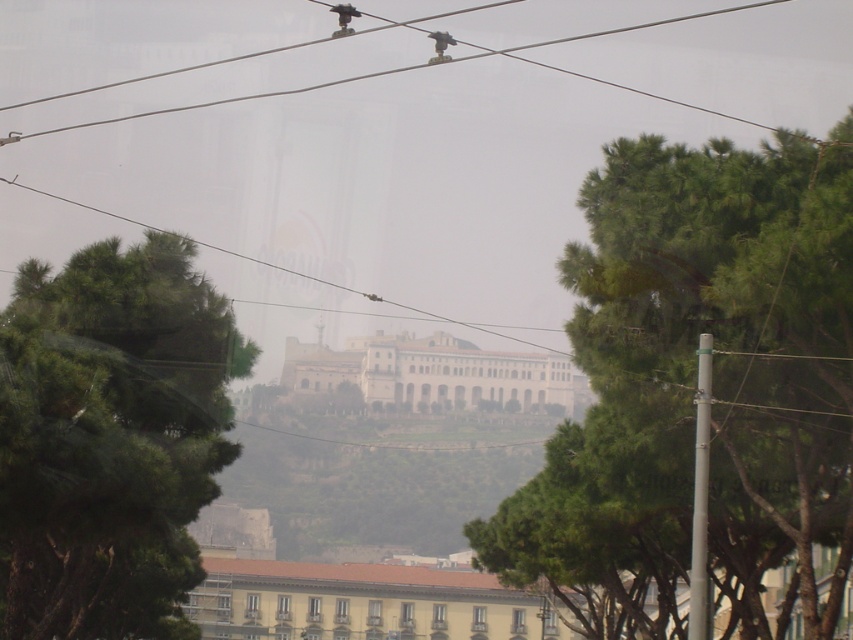
Question: Considering the real-world distances, which object is farthest from the dark green leafy tree at left?

Choices:
 (A) green leafy tree at center
 (B) white stone building at center

Answer: (B)

Question: Does white stucco building at center appear on the left side of clear wire at center?

Choices:
 (A) yes
 (B) no

Answer: (B)

Question: Which point is closer to the camera taking this photo?

Choices:
 (A) (x=76, y=580)
 (B) (x=462, y=324)
 (C) (x=233, y=579)

Answer: (A)

Question: Can you confirm if green leafy tree at center is positioned to the right of white stone building at center?

Choices:
 (A) yes
 (B) no

Answer: (A)

Question: Does dark green leafy tree at left have a larger size compared to white stone building at center?

Choices:
 (A) yes
 (B) no

Answer: (B)

Question: Which of the following is the farthest from the observer?

Choices:
 (A) green leafy tree at center
 (B) clear wire at center
 (C) dark green leafy tree at left

Answer: (B)